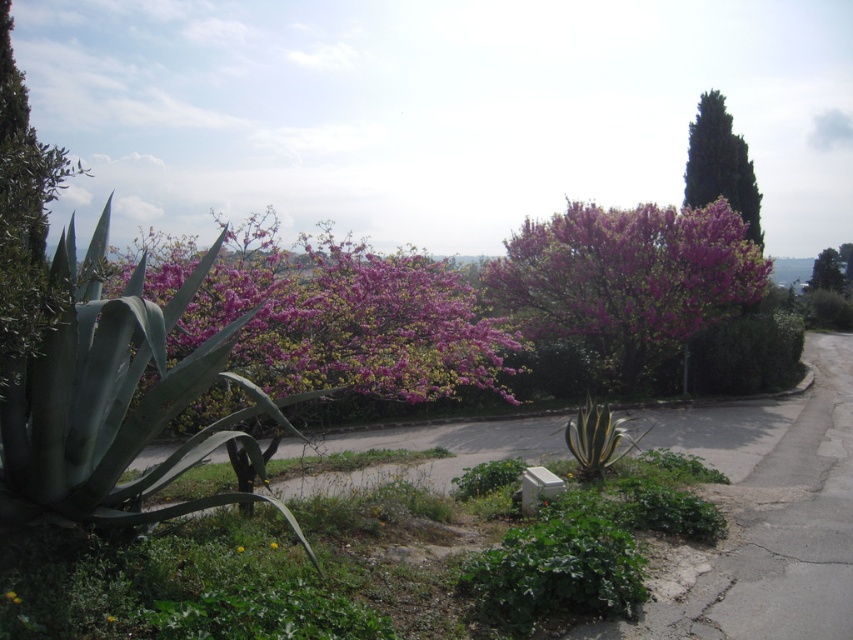
Identify the location of pink bloom bush at center. (628, 280).

Does pink bloom bush at center appear under green textured tree at upper right?

Yes, pink bloom bush at center is below green textured tree at upper right.

The width and height of the screenshot is (853, 640). Describe the element at coordinates (628, 280) in the screenshot. I see `pink bloom bush at center` at that location.

This screenshot has height=640, width=853. I want to click on pink bloom bush at center, so click(x=628, y=280).

Is point (701, 125) positioned in front of point (827, 262)?

Yes, point (701, 125) is in front of point (827, 262).

The image size is (853, 640). What do you see at coordinates (720, 164) in the screenshot?
I see `green textured tree at upper right` at bounding box center [720, 164].

Locate an element on the screen. green textured tree at upper right is located at coordinates (720, 164).

This screenshot has height=640, width=853. I want to click on green textured tree at upper right, so click(720, 164).

Based on the photo, who is taller, pink bloom at center or pink bloom bush at center?

Standing taller between the two is pink bloom at center.

Between pink bloom at center and pink bloom bush at center, which one is positioned lower?

pink bloom bush at center

Who is more distant from viewer, (260, 326) or (721, 232)?

Point (721, 232)

This screenshot has width=853, height=640. In order to click on pink bloom at center in this screenshot , I will do `click(347, 320)`.